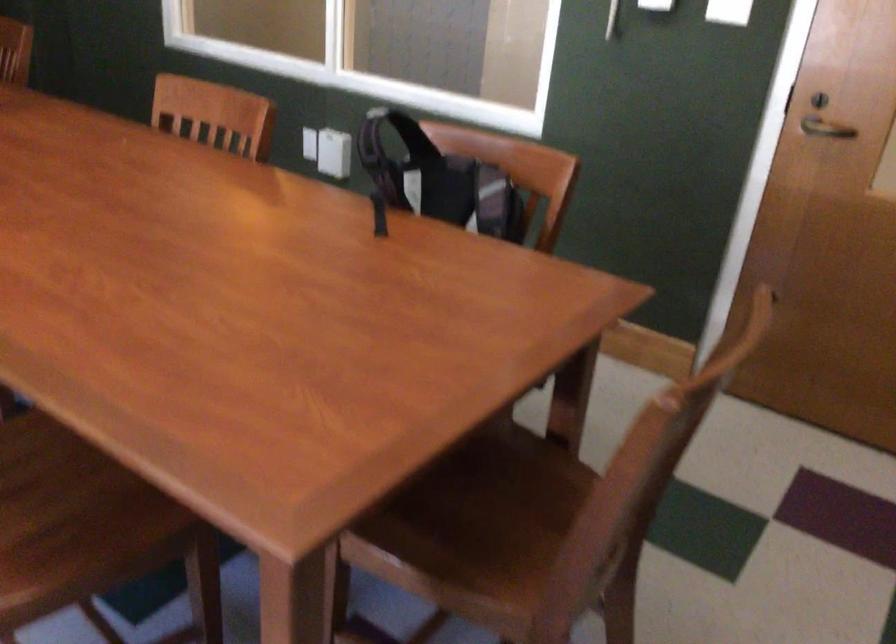
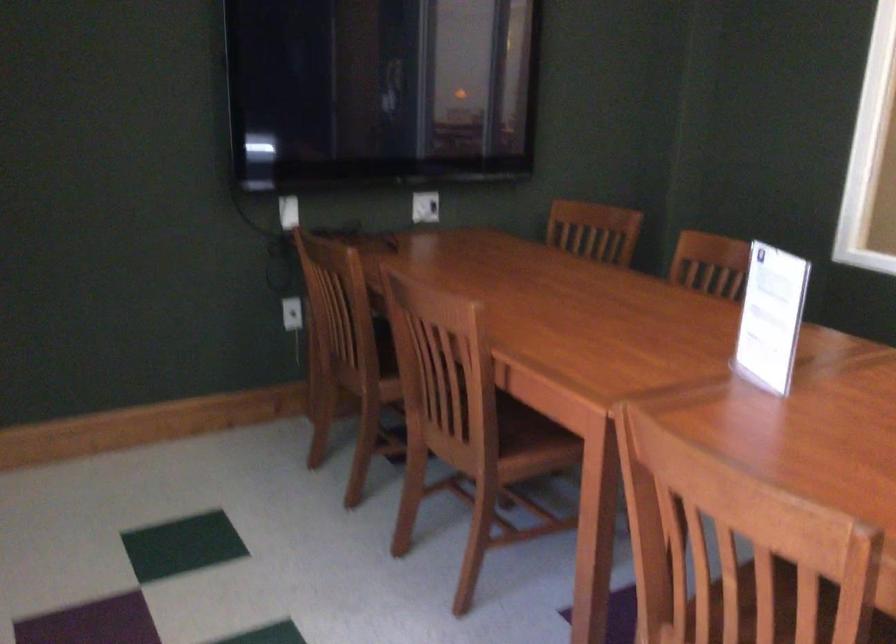
Question: Which direction would the cameraman need to move to produce the second image? Reply with the corresponding letter.

Choices:
 (A) Left
 (B) Right
 (C) Forward
 (D) Backward

Answer: (A)